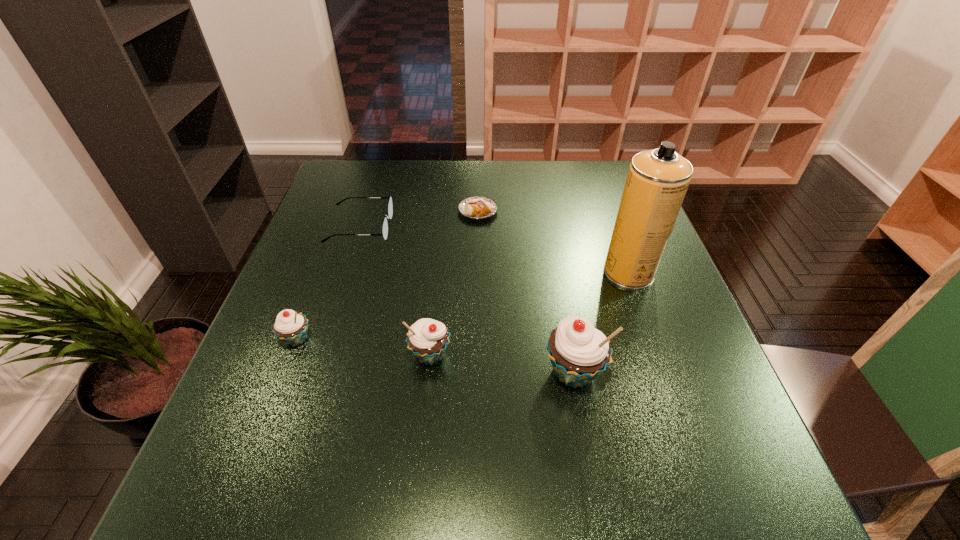
Locate an element on the screen. cupcake that stands as the second closest to the second cupcake from left to right is located at coordinates (291, 327).

Identify the location of vacant position in the image that satisfies the following two spatial constraints: 1. on the lenses of the rightmost object; 2. on the left side of the spectacles. Image resolution: width=960 pixels, height=540 pixels. (346, 272).

Locate an element on the screen. Image resolution: width=960 pixels, height=540 pixels. free space that satisfies the following two spatial constraints: 1. on the back side of the fourth shortest object; 2. on the lenses of the second shortest object is located at coordinates (443, 227).

This screenshot has width=960, height=540. What are the coordinates of `vacant area that satisfies the following two spatial constraints: 1. on the back side of the fourth shortest object; 2. on the right side of the rightmost object` in the screenshot? It's located at (439, 272).

Identify the location of free space that satisfies the following two spatial constraints: 1. on the lenses of the second object from right to left; 2. on the left side of the fifth tallest object. Image resolution: width=960 pixels, height=540 pixels. (314, 372).

Where is `free location that satisfies the following two spatial constraints: 1. on the lenses of the second tallest object; 2. on the right side of the spectacles`? free location that satisfies the following two spatial constraints: 1. on the lenses of the second tallest object; 2. on the right side of the spectacles is located at coordinates (314, 372).

Image resolution: width=960 pixels, height=540 pixels. In order to click on free space that satisfies the following two spatial constraints: 1. on the front side of the rightmost object; 2. on the right side of the pastry in this screenshot , I will do `click(477, 272)`.

Where is `free space that satisfies the following two spatial constraints: 1. on the back side of the rightmost object; 2. on the lenses of the fifth tallest object`? free space that satisfies the following two spatial constraints: 1. on the back side of the rightmost object; 2. on the lenses of the fifth tallest object is located at coordinates (612, 227).